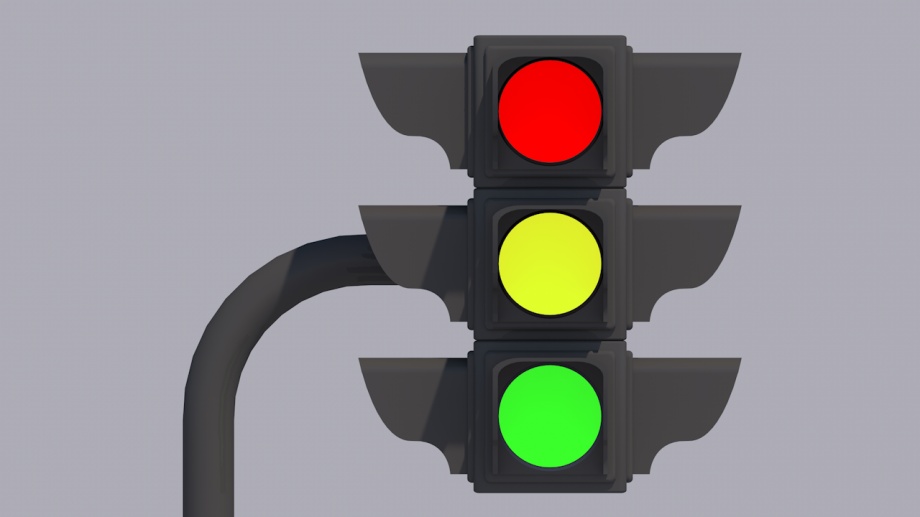
Locate an element on the screen. The height and width of the screenshot is (517, 920). green light is located at coordinates (553, 408).